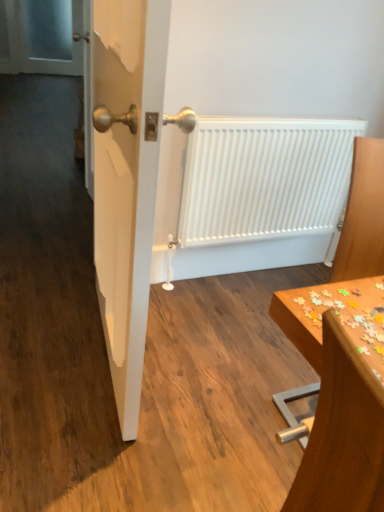
At what (x,y) coordinates should I click in order to perform the action: click on free location to the right of white glossy door at center. Please return your answer as a coordinate pair (x, y). Looking at the image, I should click on (205, 369).